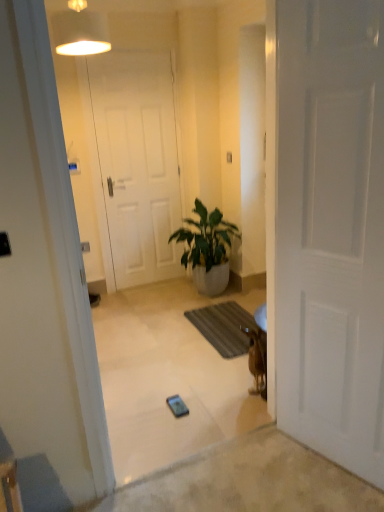
The image size is (384, 512). I want to click on unoccupied space behind brown furry dog at right, so click(237, 374).